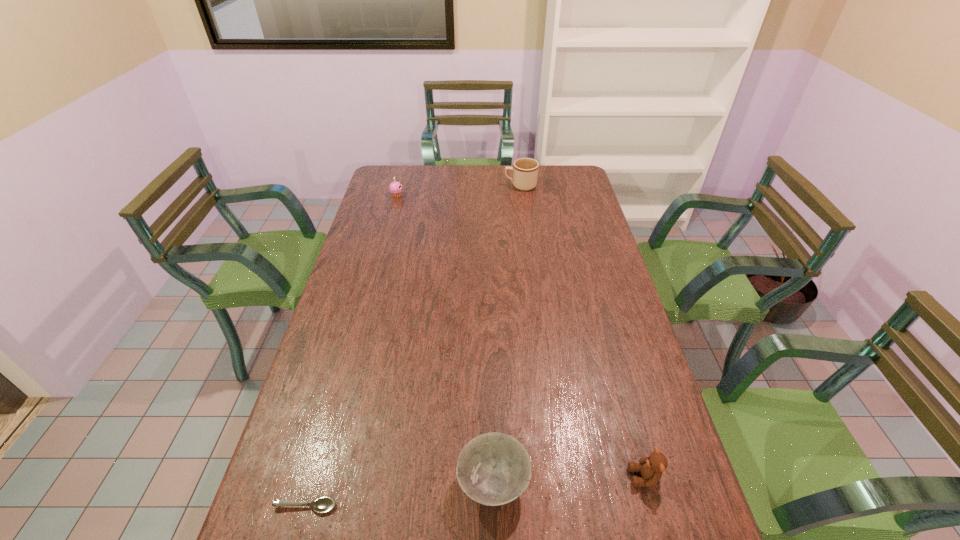
The width and height of the screenshot is (960, 540). Identify the location of the second closest object to the rightmost object. (322, 505).

In order to click on object that is the third closest to the soupspoon in this screenshot , I will do `click(395, 188)`.

Identify the location of vacant space that satisfies the following two spatial constraints: 1. on the face of the cupcake; 2. on the right side of the bowl. (321, 483).